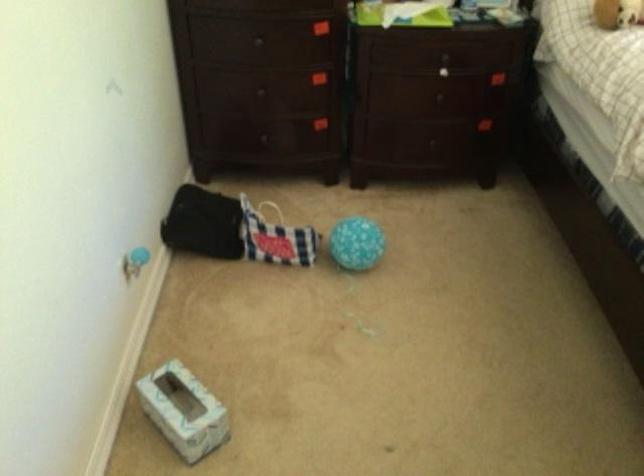
Find the location of a particular element. The width and height of the screenshot is (644, 476). tote bag handle is located at coordinates (270, 210).